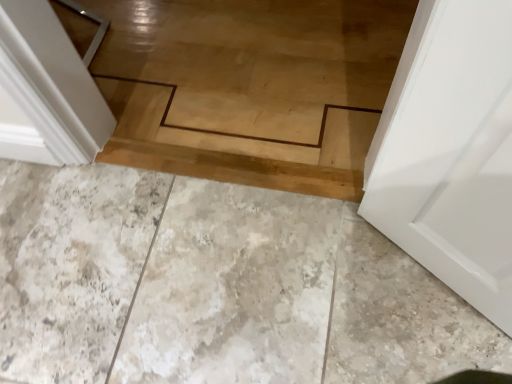
Measure the distance between point (76, 261) and camera.

A distance of 1.08 meters exists between point (76, 261) and camera.

I want to click on gray marble tile at center, so click(x=291, y=298).

This screenshot has width=512, height=384. What do you see at coordinates (291, 298) in the screenshot? I see `gray marble tile at center` at bounding box center [291, 298].

Locate an element on the screen. This screenshot has height=384, width=512. gray marble tile at center is located at coordinates (291, 298).